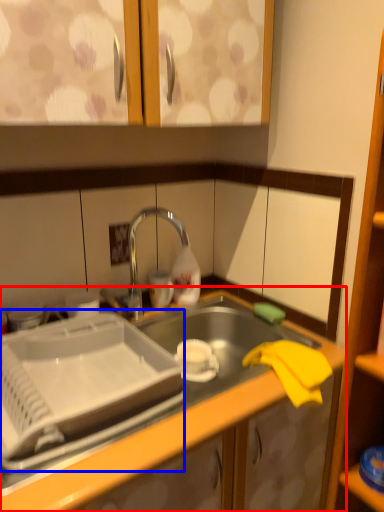
Question: Which object appears closest to the camera in this image, countertop (highlighted by a red box) or appliance (highlighted by a blue box)?

Choices:
 (A) countertop
 (B) appliance

Answer: (A)